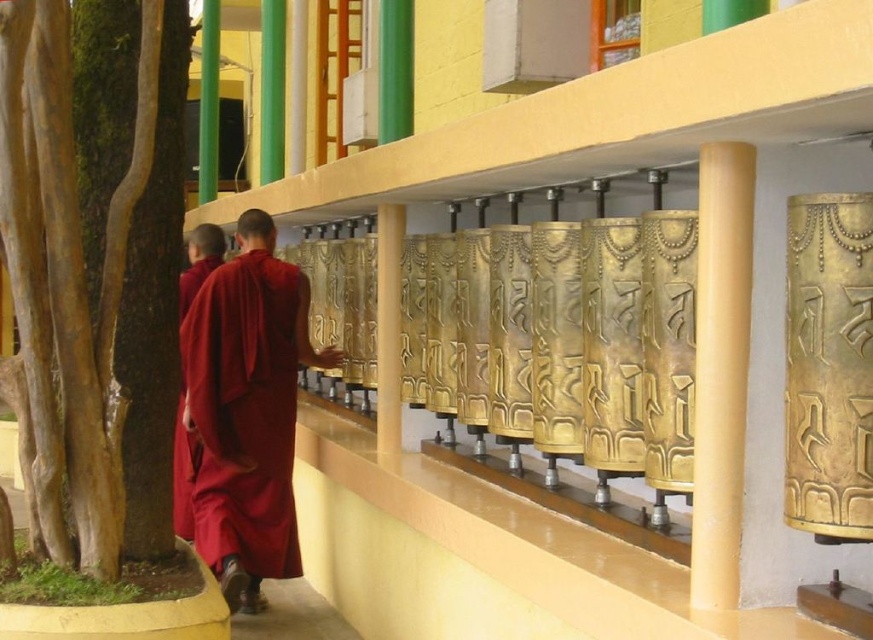
Measure the distance between point [80,532] and camera.

The distance of point [80,532] from camera is 3.08 meters.

Measure the distance from smooth brown bark at left to maroon cloth monk at left.

The distance of smooth brown bark at left from maroon cloth monk at left is 6.56 feet.

Is point (24, 333) behind point (177, 508)?

No, it is in front of (177, 508).

What are the coordinates of `smooth brown bark at left` in the screenshot? It's located at (65, 284).

Looking at this image, can you confirm if smooth brown bark at left is positioned to the right of maroon cloth monk at center?

No, smooth brown bark at left is not to the right of maroon cloth monk at center.

Who is more distant from viewer, (x=86, y=557) or (x=184, y=394)?

The point (x=184, y=394) is more distant.

Where is `smooth brown bark at left`? This screenshot has width=873, height=640. smooth brown bark at left is located at coordinates (65, 284).

Who is more forward, [237,548] or [187,248]?

Point [237,548] is more forward.

Locate an element on the screen. maroon cloth monk at center is located at coordinates (246, 412).

At what (x,y) coordinates should I click in order to perform the action: click on maroon cloth monk at center. Please return your answer as a coordinate pair (x, y). Image resolution: width=873 pixels, height=640 pixels. Looking at the image, I should click on (246, 412).